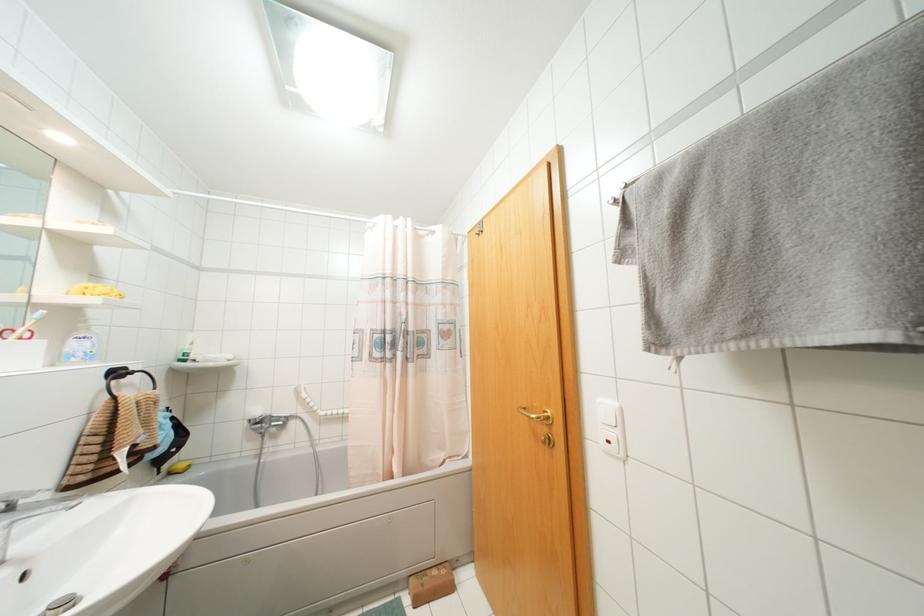
Identify the location of sink drain plug. (62, 604).